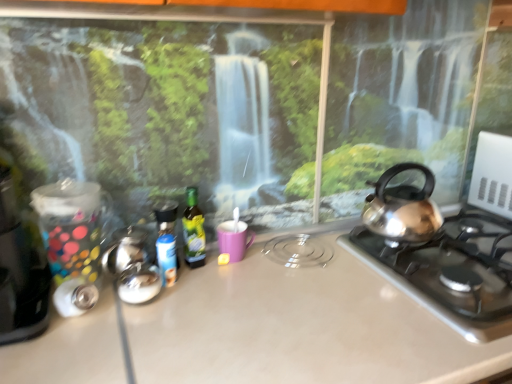
Measure the distance between green glass bottle at center, arranged as the 1th bottle when viewed from the right, and camera.

They are 1.05 meters apart.

Locate an element on the screen. matte purple mug at center is located at coordinates (234, 239).

The height and width of the screenshot is (384, 512). What are the coordinates of `blue plastic bottle at center, arranged as the second bottle when viewed from the right` in the screenshot? It's located at (166, 241).

Image resolution: width=512 pixels, height=384 pixels. Identify the location of satin silver gas stove at right. (451, 271).

This screenshot has height=384, width=512. Describe the element at coordinates (298, 326) in the screenshot. I see `matte beige countertop at center` at that location.

Locate an element on the screen. metallic silver canister at left is located at coordinates (19, 274).

Locate an element on the screen. The width and height of the screenshot is (512, 384). green glass bottle at center, the 2th bottle in the left-to-right sequence is located at coordinates (193, 230).

Is green glass bottle at center, the 2th bottle in the left-to-right sequence, at the right side of blue plastic bottle at center, the first bottle in the left-to-right sequence?

Yes.

Would you say green glass bottle at center, the 2th bottle in the left-to-right sequence, is a long distance from blue plastic bottle at center, arranged as the second bottle when viewed from the right?

No, there isn't a large distance between green glass bottle at center, the 2th bottle in the left-to-right sequence, and blue plastic bottle at center, arranged as the second bottle when viewed from the right.

In order to click on bottle directly beneath the green glass bottle at center, the 2th bottle in the left-to-right sequence (from a real-world perspective) in this screenshot , I will do `click(166, 241)`.

Measure the distance from satin silver gas stove at right to metallic silver canister at left.

They are 36.83 inches apart.

Is satin silver gas stove at right positioned with its back to metallic silver canister at left?

No, metallic silver canister at left is not at the back of satin silver gas stove at right.

Is satin silver gas stove at right situated inside metallic silver canister at left or outside?

satin silver gas stove at right lies outside metallic silver canister at left.

Could matte beige countertop at center be considered to be inside metallic silver canister at left?

Definitely not — matte beige countertop at center is not inside metallic silver canister at left.

Consider the image. Is metallic silver canister at left looking in the opposite direction of matte beige countertop at center?

No, matte beige countertop at center is not at the back of metallic silver canister at left.

Which of these two, metallic silver canister at left or matte beige countertop at center, is bigger?

With larger size is matte beige countertop at center.

Is metallic silver canister at left taller or shorter than matte beige countertop at center?

Clearly, metallic silver canister at left is shorter compared to matte beige countertop at center.

You are a GUI agent. You are given a task and a screenshot of the screen. Output one action in this format:
    pyautogui.click(x=<x>, y=<y>)
    Task: Click on the mug below the green glass bottle at center, arranged as the 1th bottle when viewed from the right (from the image's perspective)
    The height and width of the screenshot is (384, 512).
    Given the screenshot: What is the action you would take?
    pyautogui.click(x=234, y=239)

Does green glass bottle at center, the 2th bottle in the left-to-right sequence, appear on the right side of matte purple mug at center?

No.

Does green glass bottle at center, arranged as the 1th bottle when viewed from the right, turn towards matte purple mug at center?

No, green glass bottle at center, arranged as the 1th bottle when viewed from the right, is not turned towards matte purple mug at center.

Can you confirm if green glass bottle at center, arranged as the 1th bottle when viewed from the right, is bigger than matte purple mug at center?

No, green glass bottle at center, arranged as the 1th bottle when viewed from the right, is not bigger than matte purple mug at center.

Between matte beige countertop at center and matte purple mug at center, which one has smaller size?

With smaller size is matte purple mug at center.

Does matte beige countertop at center have a greater width compared to matte purple mug at center?

Yes.

Is matte beige countertop at center spatially inside matte purple mug at center, or outside of it?

matte beige countertop at center lies outside matte purple mug at center.

From a real-world perspective, is matte beige countertop at center on top of matte purple mug at center?

No, from a real-world perspective, matte beige countertop at center is not over matte purple mug at center

Is matte beige countertop at center bigger than green glass bottle at center, the 2th bottle in the left-to-right sequence?

Indeed, matte beige countertop at center has a larger size compared to green glass bottle at center, the 2th bottle in the left-to-right sequence.

Which object is closer to the camera, matte beige countertop at center or green glass bottle at center, arranged as the 1th bottle when viewed from the right?

matte beige countertop at center is closer to the camera.

Could you tell me if matte beige countertop at center is turned towards green glass bottle at center, arranged as the 1th bottle when viewed from the right?

No, matte beige countertop at center is not turned towards green glass bottle at center, arranged as the 1th bottle when viewed from the right.

Considering the positions of objects matte beige countertop at center and green glass bottle at center, the 2th bottle in the left-to-right sequence, in the image provided, who is more to the left, matte beige countertop at center or green glass bottle at center, the 2th bottle in the left-to-right sequence,?

green glass bottle at center, the 2th bottle in the left-to-right sequence.

Would you say green glass bottle at center, the 2th bottle in the left-to-right sequence, is part of matte purple mug at center's contents?

Actually, green glass bottle at center, the 2th bottle in the left-to-right sequence, is outside matte purple mug at center.

From the image's perspective, which is above, matte purple mug at center or green glass bottle at center, the 2th bottle in the left-to-right sequence?

green glass bottle at center, the 2th bottle in the left-to-right sequence.

Looking at the image, does matte purple mug at center seem bigger or smaller compared to green glass bottle at center, arranged as the 1th bottle when viewed from the right?

matte purple mug at center is bigger than green glass bottle at center, arranged as the 1th bottle when viewed from the right.

How different are the orientations of matte purple mug at center and green glass bottle at center, the 2th bottle in the left-to-right sequence, in degrees?

5.21e-05 degrees separate the facing orientations of matte purple mug at center and green glass bottle at center, the 2th bottle in the left-to-right sequence.

Identify the location of bottle on the right of blue plastic bottle at center, arranged as the second bottle when viewed from the right. (193, 230).

Identify the location of gas stove below the metallic silver canister at left (from the image's perspective). (451, 271).

Which object lies further to the anchor point matte purple mug at center, satin silver gas stove at right or matte beige countertop at center?

Based on the image, satin silver gas stove at right appears to be further to matte purple mug at center.

Which object lies further to the anchor point matte purple mug at center, metallic silver canister at left or satin silver gas stove at right?

satin silver gas stove at right.

When comparing their distances from matte beige countertop at center, does matte purple mug at center or blue plastic bottle at center, the first bottle in the left-to-right sequence, seem closer?

Based on the image, blue plastic bottle at center, the first bottle in the left-to-right sequence, appears to be nearer to matte beige countertop at center.

Which object lies further to the anchor point metallic silver canister at left, green glass bottle at center, arranged as the 1th bottle when viewed from the right, or matte purple mug at center?

matte purple mug at center lies further to metallic silver canister at left than the other object.

Based on their spatial positions, is metallic silver canister at left or satin silver gas stove at right further from blue plastic bottle at center, arranged as the second bottle when viewed from the right?

satin silver gas stove at right.

From the image, which object appears to be farther from matte beige countertop at center, blue plastic bottle at center, the first bottle in the left-to-right sequence, or metallic silver canister at left?

metallic silver canister at left lies further to matte beige countertop at center than the other object.

When comparing their distances from matte purple mug at center, does matte beige countertop at center or satin silver gas stove at right seem further?

satin silver gas stove at right is positioned further to the anchor matte purple mug at center.

Which object lies further to the anchor point satin silver gas stove at right, metallic silver canister at left or matte purple mug at center?

Among the two, metallic silver canister at left is located further to satin silver gas stove at right.

The image size is (512, 384). What are the coordinates of `mug located between metallic silver canister at left and satin silver gas stove at right in the left-right direction` in the screenshot? It's located at (234, 239).

Locate an element on the screen. countertop situated between blue plastic bottle at center, arranged as the second bottle when viewed from the right, and satin silver gas stove at right from left to right is located at coordinates (298, 326).

This screenshot has width=512, height=384. I want to click on mug between metallic silver canister at left and matte beige countertop at center, so click(x=234, y=239).

Identify the location of mug between green glass bottle at center, arranged as the 1th bottle when viewed from the right, and matte beige countertop at center, in the horizontal direction. (234, 239).